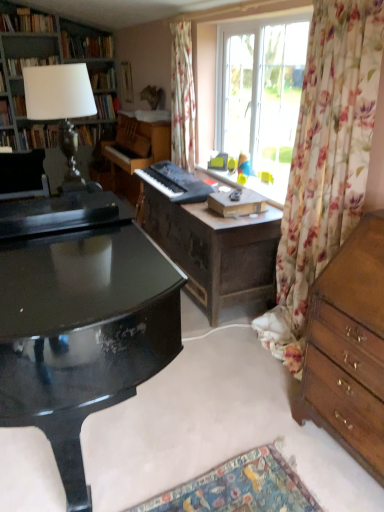
Where is `glossy wood desk at center`? glossy wood desk at center is located at coordinates (82, 329).

What do you see at coordinates (61, 109) in the screenshot?
I see `white fabric lampshade at upper left` at bounding box center [61, 109].

The image size is (384, 512). What do you see at coordinates (8, 139) in the screenshot?
I see `hardcover book at left, the 7th book when ordered from top to bottom` at bounding box center [8, 139].

Identify the location of white paper at upper left, the 3th book when ordered from top to bottom. The width and height of the screenshot is (384, 512). (29, 63).

Measure the distance between point (116, 185) and camera.

Point (116, 185) and camera are 15.38 feet apart.

What do you see at coordinates (216, 250) in the screenshot?
I see `wooden vanity at center` at bounding box center [216, 250].

Find the location of `glossy wood desk at center`. glossy wood desk at center is located at coordinates click(x=82, y=329).

From the image's perspective, starting from the hardcover book at upper center, acting as the 3th book starting from the bottom, which book is the 1st one below? Please provide its 2D coordinates.

[(39, 136)]

Measure the distance from hardcover book at upper center, acting as the 3th book starting from the bottom, to hardcover book at left, the 2th book ordered from the bottom.

hardcover book at upper center, acting as the 3th book starting from the bottom, is 9.56 feet from hardcover book at left, the 2th book ordered from the bottom.

Based on the photo, how different are the orientations of hardcover book at upper center, acting as the 3th book starting from the bottom, and hardcover book at left, the 2th book ordered from the bottom, in degrees?

They differ by 90.3 degrees in their facing directions.

Would you say hardcover book at upper center, acting as the 3th book starting from the bottom, is inside or outside hardcover book at left, acting as the 6th book starting from the top?

hardcover book at upper center, acting as the 3th book starting from the bottom, is outside hardcover book at left, acting as the 6th book starting from the top.

Which object is thinner, matte black lampshade at upper left, which is the fourth book from bottom to top, or hardcover book at left, the 2th book ordered from the bottom?

matte black lampshade at upper left, which is the fourth book from bottom to top.

How distant is matte black lampshade at upper left, which is the fourth book from bottom to top, from hardcover book at left, acting as the 6th book starting from the top?

matte black lampshade at upper left, which is the fourth book from bottom to top, is 3.09 meters from hardcover book at left, acting as the 6th book starting from the top.

Image resolution: width=384 pixels, height=512 pixels. Find the location of `the 2nd book directly above the hardcover book at left, the 2th book ordered from the bottom (from a real-world perspective)`. the 2nd book directly above the hardcover book at left, the 2th book ordered from the bottom (from a real-world perspective) is located at coordinates (103, 80).

Are matte black lampshade at upper left, which is the fourth book from bottom to top, and hardcover book at left, acting as the 6th book starting from the top, far apart?

Absolutely, matte black lampshade at upper left, which is the fourth book from bottom to top, is distant from hardcover book at left, acting as the 6th book starting from the top.

Looking at this image, considering the relative positions of wooden chest of drawers at right and white paper at upper left, which appears as the 5th book when ordered from the bottom, in the image provided, is wooden chest of drawers at right to the left or to the right of white paper at upper left, which appears as the 5th book when ordered from the bottom,?

Based on their positions, wooden chest of drawers at right is located to the right of white paper at upper left, which appears as the 5th book when ordered from the bottom.

How distant is wooden chest of drawers at right from white paper at upper left, the 3th book when ordered from top to bottom?

wooden chest of drawers at right and white paper at upper left, the 3th book when ordered from top to bottom, are 3.49 meters apart.

Is wooden chest of drawers at right inside or outside of white paper at upper left, the 3th book when ordered from top to bottom?

wooden chest of drawers at right exists outside the volume of white paper at upper left, the 3th book when ordered from top to bottom.

From the image's perspective, between wooden chest of drawers at right and white paper at upper left, which appears as the 5th book when ordered from the bottom, who is located below?

wooden chest of drawers at right is shown below in the image.

Considering the positions of objects floral fabric curtain at right, positioned as the first curtain in right-to-left order, and white fabric lampshade at upper left in the image provided, who is more to the left, floral fabric curtain at right, positioned as the first curtain in right-to-left order, or white fabric lampshade at upper left?

white fabric lampshade at upper left.

Which of these two, floral fabric curtain at right, positioned as the first curtain in right-to-left order, or white fabric lampshade at upper left, is bigger?

floral fabric curtain at right, positioned as the first curtain in right-to-left order, is bigger.

Which of these two, floral fabric curtain at right, which is the 1th curtain in front-to-back order, or white fabric lampshade at upper left, stands shorter?

white fabric lampshade at upper left.

Image resolution: width=384 pixels, height=512 pixels. Identify the location of the 2nd piano directly beneath the matte black lampshade at upper left, which is the fourth book from bottom to top (from a real-world perspective). (135, 151).

How far apart are matte black lampshade at upper left, marked as the 4th book in a top-to-bottom arrangement, and wooden piano at center, the second piano from the front?

matte black lampshade at upper left, marked as the 4th book in a top-to-bottom arrangement, and wooden piano at center, the second piano from the front, are 1.38 meters apart from each other.

Consider the image. Considering the sizes of objects matte black lampshade at upper left, marked as the 4th book in a top-to-bottom arrangement, and wooden piano at center, acting as the first piano starting from the back, in the image provided, who is smaller, matte black lampshade at upper left, marked as the 4th book in a top-to-bottom arrangement, or wooden piano at center, acting as the first piano starting from the back,?

Smaller between the two is matte black lampshade at upper left, marked as the 4th book in a top-to-bottom arrangement.

Between matte black lampshade at upper left, which is the fourth book from bottom to top, and wooden piano at center, the second piano from the front, which one appears on the left side from the viewer's perspective?

From the viewer's perspective, matte black lampshade at upper left, which is the fourth book from bottom to top, appears more on the left side.

From the image's perspective, is white paper at upper left, the 3th book when ordered from top to bottom, above floral fabric curtain at right, the 2th curtain when ordered from back to front?

Correct, white paper at upper left, the 3th book when ordered from top to bottom, appears higher than floral fabric curtain at right, the 2th curtain when ordered from back to front, in the image.

Does white paper at upper left, which appears as the 5th book when ordered from the bottom, touch floral fabric curtain at right, the 2th curtain when ordered from back to front?

No, white paper at upper left, which appears as the 5th book when ordered from the bottom, is not touching floral fabric curtain at right, the 2th curtain when ordered from back to front.

Can you confirm if white paper at upper left, which appears as the 5th book when ordered from the bottom, is thinner than floral fabric curtain at right, positioned as the first curtain in right-to-left order?

Yes.

From the image's perspective, which curtain is the 2nd one below the white paper at upper left, which appears as the 5th book when ordered from the bottom? Please provide its 2D coordinates.

[(325, 161)]

Can you tell me how much glossy wood desk at center and white paper at upper left, which appears as the 5th book when ordered from the bottom, differ in facing direction?

There is a 179-degree angle between the facing directions of glossy wood desk at center and white paper at upper left, which appears as the 5th book when ordered from the bottom.

Which object is positioned more to the left, glossy wood desk at center or white paper at upper left, which appears as the 5th book when ordered from the bottom?

white paper at upper left, which appears as the 5th book when ordered from the bottom.

In the scene shown: Is glossy wood desk at center positioned behind white paper at upper left, which appears as the 5th book when ordered from the bottom?

No, it is in front of white paper at upper left, which appears as the 5th book when ordered from the bottom.

Would you say glossy wood desk at center is a long distance from white paper at upper left, the 3th book when ordered from top to bottom?

Yes, glossy wood desk at center is far from white paper at upper left, the 3th book when ordered from top to bottom.

Locate an element on the screen. Image resolution: width=384 pixels, height=512 pixels. the 1st book positioned above the hardcover book at left, acting as the 6th book starting from the top (from the image's perspective) is located at coordinates (126, 82).

Starting from the hardcover book at left, the 2th book ordered from the bottom, which book is the 3rd one to the right? Please provide its 2D coordinates.

[(103, 80)]

Based on the photo, looking at the image, which one is located closer to floral fabric curtain at upper center, which is the 1th curtain in left-to-right order, black matte keyboard at center, which appears as the 1th piano when viewed from the front, or matte black lampshade at upper left, which is the fourth book from bottom to top?

Based on the image, black matte keyboard at center, which appears as the 1th piano when viewed from the front, appears to be nearer to floral fabric curtain at upper center, which is the 1th curtain in left-to-right order.

When comparing their distances from hardcover book at upper left, which is counted as the first book, starting from the top, does matte black lampshade at upper left, marked as the 4th book in a top-to-bottom arrangement, or hardcover book at upper center, acting as the fifth book starting from the top, seem further?

hardcover book at upper center, acting as the fifth book starting from the top, is positioned further to the anchor hardcover book at upper left, which is counted as the first book, starting from the top.

Estimate the real-world distances between objects in this image. Which object is further from floral fabric curtain at right, which is the 1th curtain in front-to-back order, black matte keyboard at center, marked as the 2th piano in a back-to-front arrangement, or hardcover book at left, the 7th book when ordered from top to bottom?

Among the two, hardcover book at left, the 7th book when ordered from top to bottom, is located further to floral fabric curtain at right, which is the 1th curtain in front-to-back order.

Estimate the real-world distances between objects in this image. Which object is further from black matte keyboard at center, which appears as the 1th piano when viewed from the front, white paper at upper left, which appears as the 5th book when ordered from the bottom, or floral fabric curtain at right, which is the 1th curtain in front-to-back order?

Among the two, white paper at upper left, which appears as the 5th book when ordered from the bottom, is located further to black matte keyboard at center, which appears as the 1th piano when viewed from the front.

Which object lies nearer to the anchor point floral fabric curtain at right, positioned as the first curtain in right-to-left order, wooden piano at center, acting as the first piano starting from the back, or white paper at upper left, which appears as the 5th book when ordered from the bottom?

wooden piano at center, acting as the first piano starting from the back.

From the image, which object appears to be nearer to white fabric lampshade at upper left, hardcover book at upper left, the 7th book ordered from the bottom, or silver metallic lamp at upper left?

silver metallic lamp at upper left.

Looking at the image, which one is located further to wooden chest of drawers at right, wooden vanity at center or hardcover book at upper center, acting as the 3th book starting from the bottom?

Among the two, hardcover book at upper center, acting as the 3th book starting from the bottom, is located further to wooden chest of drawers at right.

From the image, which object appears to be farther from matte black lampshade at upper left, marked as the 4th book in a top-to-bottom arrangement, hardcover book at upper left, the 7th book ordered from the bottom, or white paper at upper left, which appears as the 5th book when ordered from the bottom?

hardcover book at upper left, the 7th book ordered from the bottom.

Where is `cabinetry between floral fabric curtain at upper center, the second curtain viewed from the front, and matte black lampshade at upper left, marked as the 4th book in a top-to-bottom arrangement, from front to back`? The width and height of the screenshot is (384, 512). cabinetry between floral fabric curtain at upper center, the second curtain viewed from the front, and matte black lampshade at upper left, marked as the 4th book in a top-to-bottom arrangement, from front to back is located at coordinates (42, 61).

At what (x,y) coordinates should I click in order to perform the action: click on vanity between wooden chest of drawers at right and white paper at upper left, which appears as the 5th book when ordered from the bottom, from front to back. Please return your answer as a coordinate pair (x, y). Looking at the image, I should click on (216, 250).

Locate an element on the screen. cabinetry between wooden vanity at center and hardcover books at upper left, which is the sixth book from bottom to top, along the z-axis is located at coordinates (42, 61).

The image size is (384, 512). What are the coordinates of `curtain between wooden vanity at center and wooden piano at center, the second piano from the front, along the z-axis` in the screenshot? It's located at (182, 97).